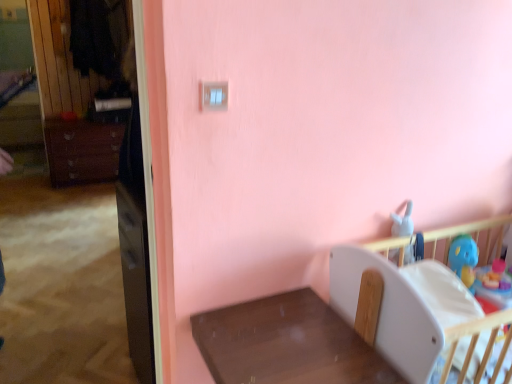
Question: Is white plastic infant bed at lower right wider than blue rubber duck at right?

Choices:
 (A) yes
 (B) no

Answer: (A)

Question: Is the depth of white plastic infant bed at lower right greater than that of blue rubber duck at right?

Choices:
 (A) yes
 (B) no

Answer: (B)

Question: From a real-world perspective, is white plastic infant bed at lower right on blue rubber duck at right?

Choices:
 (A) yes
 (B) no

Answer: (B)

Question: Is white plastic infant bed at lower right completely or partially outside of blue rubber duck at right?

Choices:
 (A) yes
 (B) no

Answer: (A)

Question: Is white plastic infant bed at lower right next to blue rubber duck at right?

Choices:
 (A) no
 (B) yes

Answer: (A)

Question: Considering the positions of blue rubber duck at right and white plastic infant bed at lower right in the image, is blue rubber duck at right taller or shorter than white plastic infant bed at lower right?

Choices:
 (A) short
 (B) tall

Answer: (A)

Question: Based on their positions, is blue rubber duck at right located to the left or right of white plastic infant bed at lower right?

Choices:
 (A) right
 (B) left

Answer: (A)

Question: Is blue rubber duck at right bigger or smaller than white plastic infant bed at lower right?

Choices:
 (A) big
 (B) small

Answer: (B)

Question: From the image's perspective, is blue rubber duck at right positioned above or below white plastic infant bed at lower right?

Choices:
 (A) below
 (B) above

Answer: (B)

Question: From a real-world perspective, is matte brown dresser at left physically located above or below brown wooden table at lower center?

Choices:
 (A) above
 (B) below

Answer: (B)

Question: Relative to brown wooden table at lower center, is matte brown dresser at left in front or behind?

Choices:
 (A) front
 (B) behind

Answer: (B)

Question: Considering the relative positions of matte brown dresser at left and brown wooden table at lower center in the image provided, is matte brown dresser at left to the left or to the right of brown wooden table at lower center?

Choices:
 (A) left
 (B) right

Answer: (A)

Question: Based on their sizes in the image, would you say matte brown dresser at left is bigger or smaller than brown wooden table at lower center?

Choices:
 (A) small
 (B) big

Answer: (B)

Question: Is white plastic infant bed at lower right taller or shorter than matte brown dresser at left?

Choices:
 (A) short
 (B) tall

Answer: (B)

Question: From a real-world perspective, is white plastic infant bed at lower right positioned above or below matte brown dresser at left?

Choices:
 (A) below
 (B) above

Answer: (B)